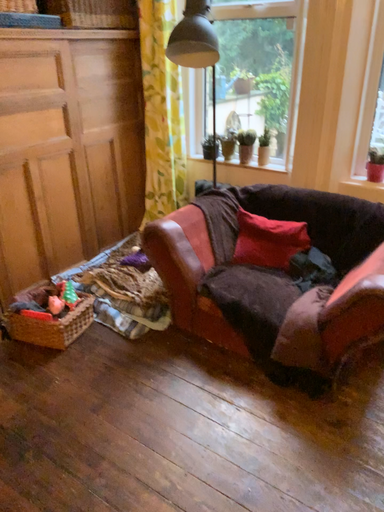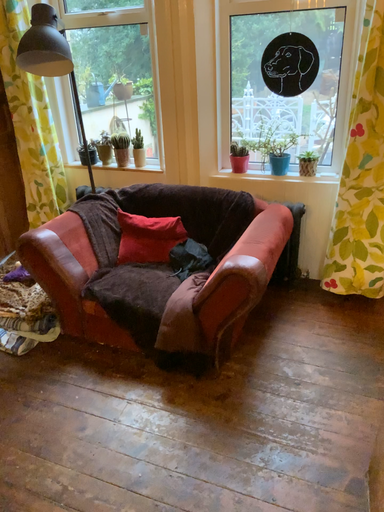
Question: How did the camera likely rotate when shooting the video?

Choices:
 (A) rotated right
 (B) rotated left

Answer: (A)